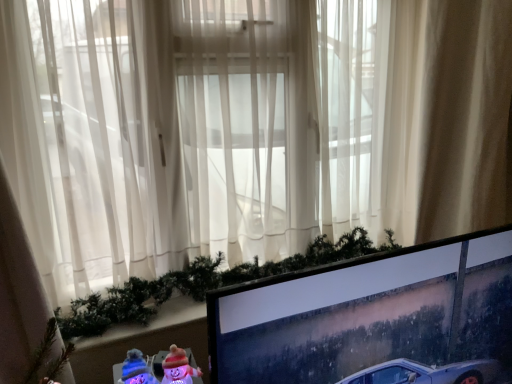
Question: From the image's perspective, is beige fabric curtain at right over matte black monitor at lower right?

Choices:
 (A) no
 (B) yes

Answer: (B)

Question: From a real-world perspective, is beige fabric curtain at right physically above matte black monitor at lower right?

Choices:
 (A) yes
 (B) no

Answer: (A)

Question: Is beige fabric curtain at right shorter than matte black monitor at lower right?

Choices:
 (A) yes
 (B) no

Answer: (B)

Question: Is beige fabric curtain at right facing away from matte black monitor at lower right?

Choices:
 (A) no
 (B) yes

Answer: (A)

Question: Considering the relative sizes of beige fabric curtain at right and matte black monitor at lower right in the image provided, is beige fabric curtain at right bigger than matte black monitor at lower right?

Choices:
 (A) no
 (B) yes

Answer: (B)

Question: Can you confirm if beige fabric curtain at right is wider than matte black monitor at lower right?

Choices:
 (A) no
 (B) yes

Answer: (B)

Question: From a real-world perspective, does matte black monitor at lower right stand above beige fabric curtain at right?

Choices:
 (A) yes
 (B) no

Answer: (B)

Question: Can you confirm if matte black monitor at lower right is thinner than beige fabric curtain at right?

Choices:
 (A) yes
 (B) no

Answer: (A)

Question: Can you confirm if matte black monitor at lower right is positioned to the left of beige fabric curtain at right?

Choices:
 (A) no
 (B) yes

Answer: (B)

Question: Is beige fabric curtain at right at the back of matte black monitor at lower right?

Choices:
 (A) no
 (B) yes

Answer: (A)

Question: Can you confirm if matte black monitor at lower right is smaller than beige fabric curtain at right?

Choices:
 (A) yes
 (B) no

Answer: (A)

Question: Could you tell me if matte black monitor at lower right is facing beige fabric curtain at right?

Choices:
 (A) yes
 (B) no

Answer: (B)

Question: In the image, is matte black monitor at lower right positioned in front of or behind beige fabric curtain at right?

Choices:
 (A) front
 (B) behind

Answer: (A)